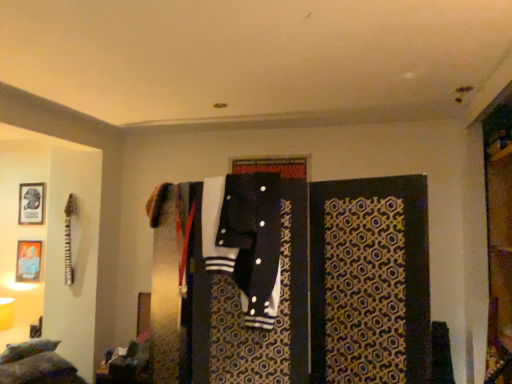
Question: Is black fabric closet at center positioned behind black cotton jacket at center?

Choices:
 (A) yes
 (B) no

Answer: (B)

Question: Is black fabric closet at center at the right side of black cotton jacket at center?

Choices:
 (A) yes
 (B) no

Answer: (A)

Question: Considering the relative sizes of black fabric closet at center and black cotton jacket at center in the image provided, is black fabric closet at center wider than black cotton jacket at center?

Choices:
 (A) yes
 (B) no

Answer: (A)

Question: Is black fabric closet at center positioned with its back to black cotton jacket at center?

Choices:
 (A) yes
 (B) no

Answer: (A)

Question: From the image's perspective, would you say black fabric closet at center is positioned over black cotton jacket at center?

Choices:
 (A) yes
 (B) no

Answer: (B)

Question: Is black fabric closet at center completely or partially outside of black cotton jacket at center?

Choices:
 (A) no
 (B) yes

Answer: (B)

Question: From the image's perspective, would you say matte gold picture frame at upper left, which is the second picture frame in top-to-bottom order, is shown under black fabric closet at center?

Choices:
 (A) no
 (B) yes

Answer: (B)

Question: From a real-world perspective, is matte gold picture frame at upper left, the 1th picture frame when ordered from bottom to top, located beneath black fabric closet at center?

Choices:
 (A) yes
 (B) no

Answer: (A)

Question: Does matte gold picture frame at upper left, which is the second picture frame in top-to-bottom order, have a lesser height compared to black fabric closet at center?

Choices:
 (A) no
 (B) yes

Answer: (B)

Question: Is matte gold picture frame at upper left, the 1th picture frame when ordered from bottom to top, at the right side of black fabric closet at center?

Choices:
 (A) yes
 (B) no

Answer: (B)

Question: Are matte gold picture frame at upper left, which is the second picture frame in top-to-bottom order, and black fabric closet at center located far from each other?

Choices:
 (A) no
 (B) yes

Answer: (B)

Question: Is matte gold picture frame at upper left, which is the second picture frame in top-to-bottom order, not inside black fabric closet at center?

Choices:
 (A) yes
 (B) no

Answer: (A)

Question: Can you confirm if black cotton jacket at center is shorter than metallic silver picture frame at upper left, which ranks as the first picture frame in top-to-bottom order?

Choices:
 (A) no
 (B) yes

Answer: (A)